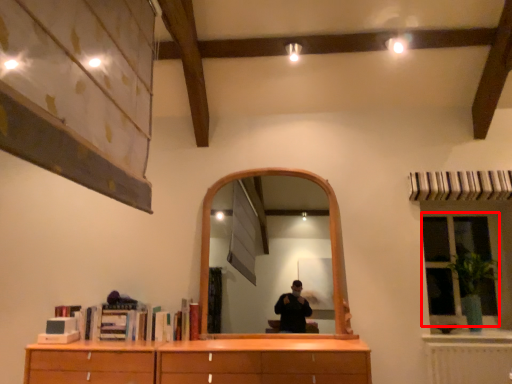
Question: From the image's perspective, where is window (annotated by the red box) located in relation to plant in the image?

Choices:
 (A) above
 (B) below

Answer: (A)